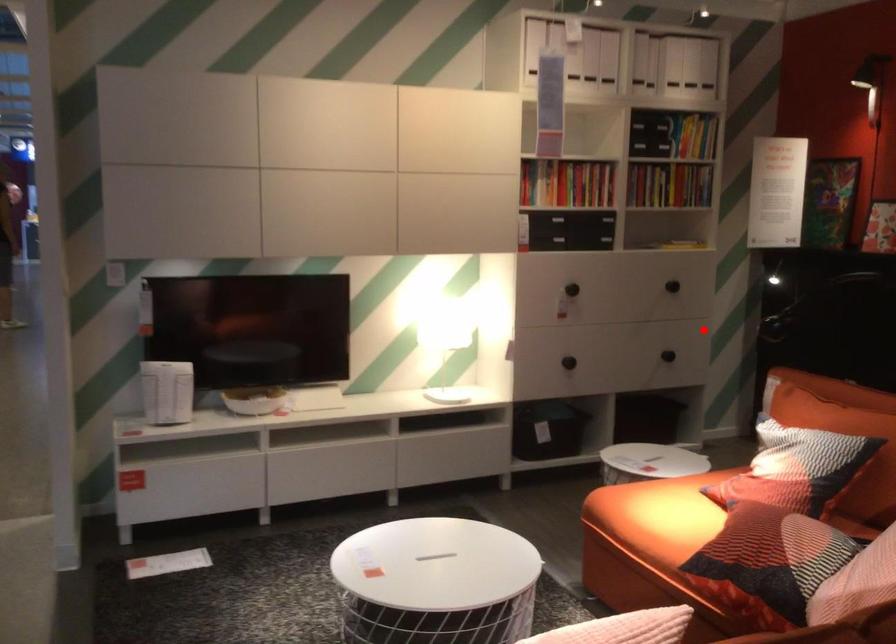
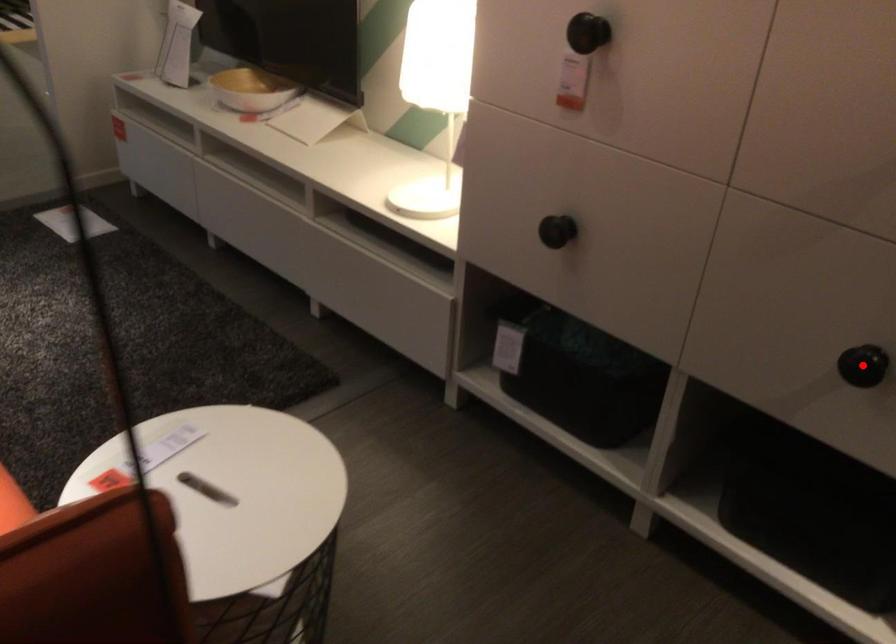
I am providing you with two images of the same scene from different viewpoints. A red point is marked on the first image and another point is marked on the second image. Does the point marked in image1 correspond to the same location as the one in image2?

Yes